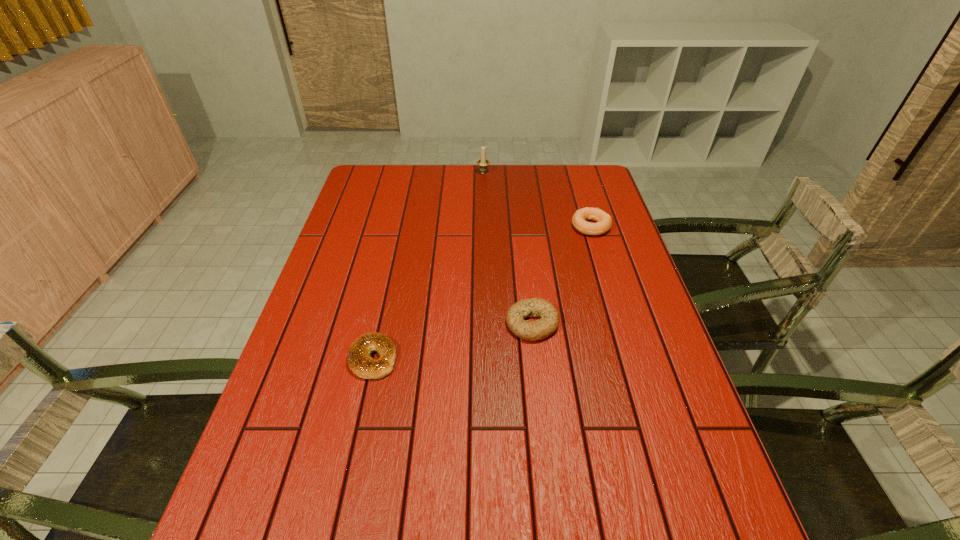
At what (x,y) coordinates should I click in order to perform the action: click on bagel that is the closest to the second bagel from right to left. Please return your answer as a coordinate pair (x, y). Image resolution: width=960 pixels, height=540 pixels. Looking at the image, I should click on (359, 361).

This screenshot has height=540, width=960. What are the coordinates of `free space in the image that satisfies the following two spatial constraints: 1. on the back side of the leftmost bagel; 2. on the left side of the third object from left to right` in the screenshot? It's located at (380, 323).

Where is `free space that satisfies the following two spatial constraints: 1. on the back side of the third nearest object; 2. on the right side of the leftmost object`? This screenshot has height=540, width=960. free space that satisfies the following two spatial constraints: 1. on the back side of the third nearest object; 2. on the right side of the leftmost object is located at coordinates (401, 226).

Identify the location of blank area in the image that satisfies the following two spatial constraints: 1. on the back side of the second bagel from left to right; 2. on the right side of the rightmost bagel. (521, 226).